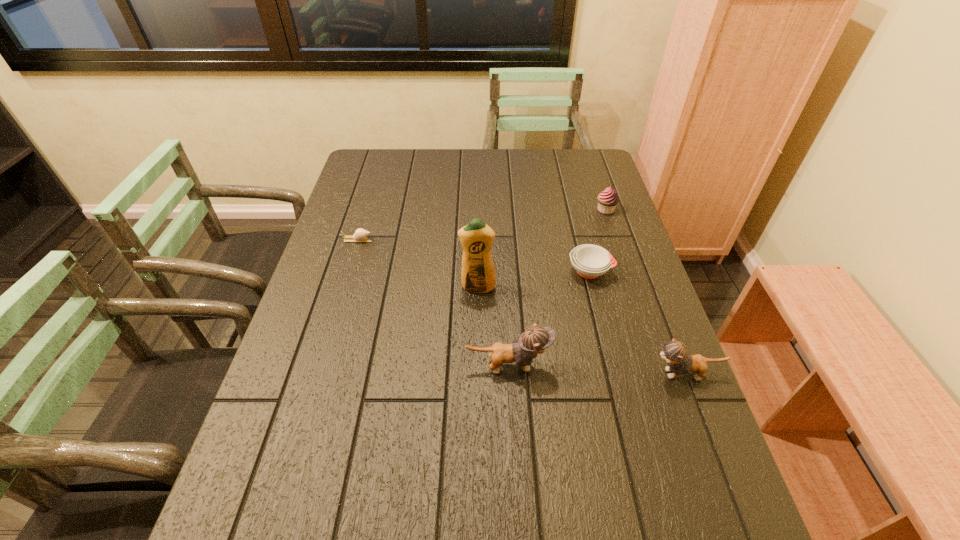
You are a GUI agent. You are given a task and a screenshot of the screen. Output one action in this format:
    pyautogui.click(x=<x>, y=<y>)
    Task: Click on the left kitten
    
    Given the screenshot: What is the action you would take?
    pyautogui.click(x=536, y=339)

At what (x,y) coordinates should I click in order to perform the action: click on the fifth shortest object. Please return your answer as a coordinate pair (x, y). The image size is (960, 540). Looking at the image, I should click on click(536, 339).

Locate an element on the screen. the shorter kitten is located at coordinates (675, 352).

Find the location of a particular element. the fourth shortest object is located at coordinates (675, 352).

Where is `the farthest object`? the farthest object is located at coordinates (607, 200).

In order to click on cupcake in this screenshot , I will do `click(607, 200)`.

The height and width of the screenshot is (540, 960). I want to click on the fifth nearest object, so click(x=360, y=235).

Identify the location of escargot. (360, 235).

Identify the location of soup bowl. The height and width of the screenshot is (540, 960). (590, 261).

Where is `the fifth tallest object`? the fifth tallest object is located at coordinates (590, 261).